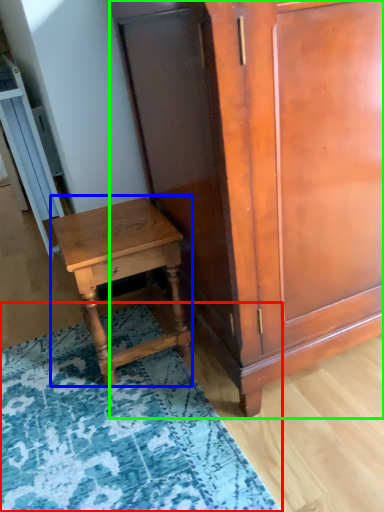
Question: Estimate the real-world distances between objects in this image. Which object is farther from mat (highlighted by a red box), nightstand (highlighted by a blue box) or cabinetry (highlighted by a green box)?

Choices:
 (A) nightstand
 (B) cabinetry

Answer: (B)